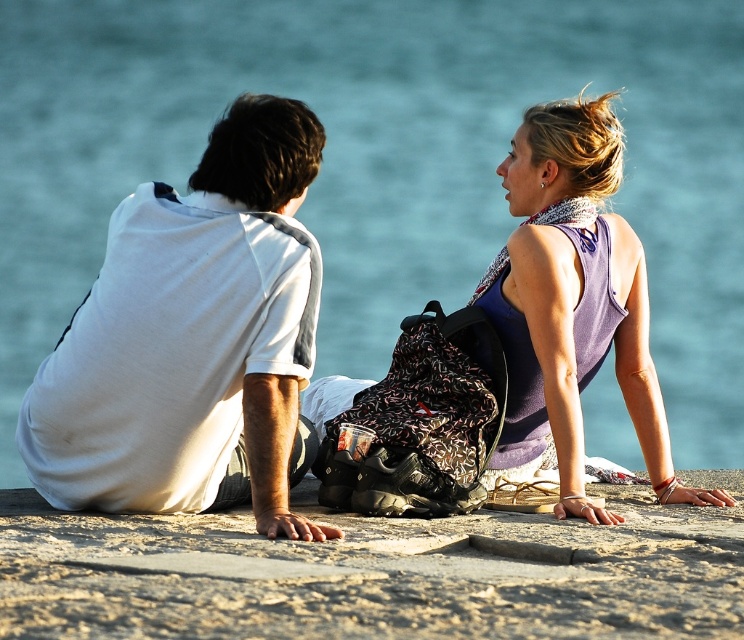
Is white cotton shirt at left above purple fabric tank top at upper right?

Actually, white cotton shirt at left is below purple fabric tank top at upper right.

Is point (283, 500) closer to viewer compared to point (525, 340)?

Yes, point (283, 500) is in front of point (525, 340).

Where is `white cotton shirt at left`? white cotton shirt at left is located at coordinates (193, 339).

Looking at this image, does smooth concrete surface at center have a greater height compared to purple fabric tank top at upper right?

In fact, smooth concrete surface at center may be shorter than purple fabric tank top at upper right.

Consider the image. Is smooth concrete surface at center smaller than purple fabric tank top at upper right?

Correct, smooth concrete surface at center occupies less space than purple fabric tank top at upper right.

Between point (626, 499) and point (554, 163), which one is positioned behind?

The point (554, 163) is more distant.

At what (x,y) coordinates should I click in order to perform the action: click on smooth concrete surface at center. Please return your answer as a coordinate pair (x, y). The width and height of the screenshot is (744, 640). Looking at the image, I should click on (376, 573).

Locate an element on the screen. smooth concrete surface at center is located at coordinates (376, 573).

Does smooth concrete surface at center have a larger size compared to white cotton shirt at left?

No, smooth concrete surface at center is not bigger than white cotton shirt at left.

Between point (77, 561) and point (179, 468), which one is positioned in front?

Positioned in front is point (77, 561).

Locate an element on the screen. This screenshot has height=640, width=744. smooth concrete surface at center is located at coordinates (376, 573).